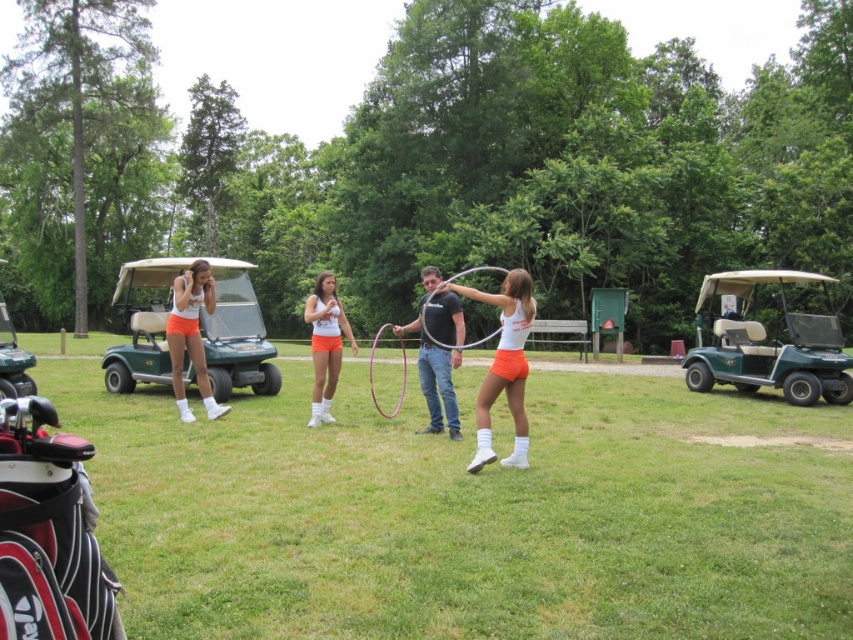
Question: Is green matte golf cart at right to the left of white matte tank top at center from the viewer's perspective?

Choices:
 (A) no
 (B) yes

Answer: (A)

Question: Which of the following is the farthest from the observer?

Choices:
 (A) (492, 356)
 (B) (7, 376)

Answer: (A)

Question: Does green matte golf cart at left lie in front of pink rubber hula hoop at center?

Choices:
 (A) yes
 (B) no

Answer: (B)

Question: Which point appears farthest from the camera in this image?

Choices:
 (A) (685, 372)
 (B) (448, 394)
 (C) (201, 324)
 (D) (506, 365)

Answer: (A)

Question: Can you confirm if white matte tank top at center is bigger than green plastic golf cart at left?

Choices:
 (A) no
 (B) yes

Answer: (A)

Question: Which point is closer to the camera taking this photo?

Choices:
 (A) (3, 360)
 (B) (328, 269)

Answer: (A)